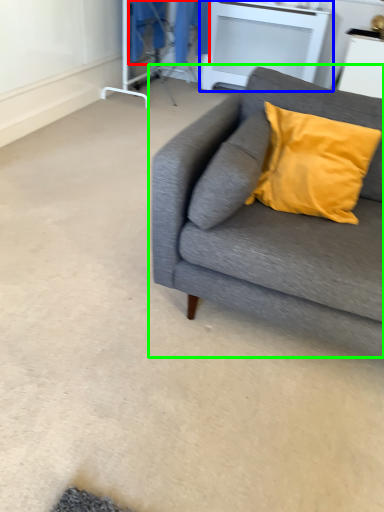
Question: Which object is positioned closest to laundry (highlighted by a red box)? Select from table (highlighted by a blue box) and studio couch (highlighted by a green box).

Choices:
 (A) table
 (B) studio couch

Answer: (A)